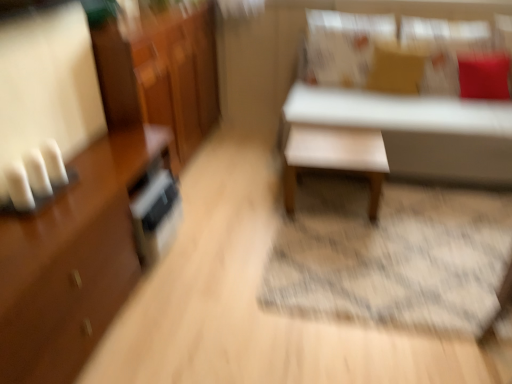
This screenshot has width=512, height=384. In order to click on free space above brown glossy cabinet at left (from a real-world perspective) in this screenshot , I will do `click(57, 198)`.